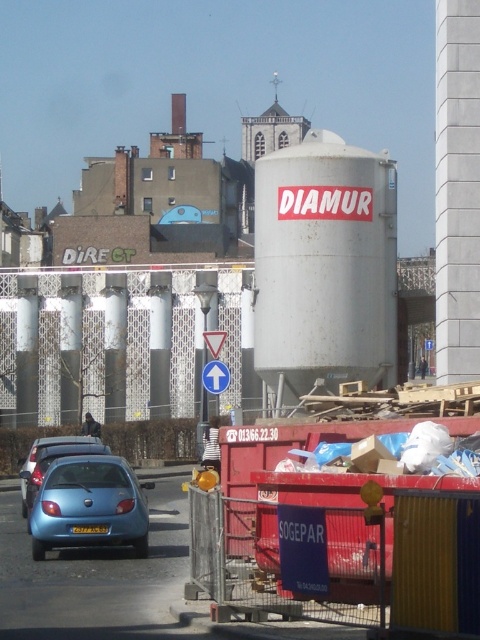
Can you confirm if rusty metal water tower at center is positioned to the right of matte blue car at lower left?

Correct, you'll find rusty metal water tower at center to the right of matte blue car at lower left.

Which is in front, point (272, 385) or point (84, 483)?

Point (84, 483)

This screenshot has height=640, width=480. Describe the element at coordinates (324, 266) in the screenshot. I see `rusty metal water tower at center` at that location.

At what (x,y) coordinates should I click in order to perform the action: click on rusty metal water tower at center. Please return your answer as a coordinate pair (x, y). The width and height of the screenshot is (480, 640). Looking at the image, I should click on (324, 266).

Which of these two, rusty metal water tower at center or white plastic traffic sign at center, stands taller?

With more height is rusty metal water tower at center.

Does point (369, 296) come farther from viewer compared to point (220, 381)?

Yes, it is.

Between point (304, 248) and point (226, 371), which one is positioned in front?

Positioned in front is point (226, 371).

In order to click on rusty metal water tower at center in this screenshot , I will do `click(324, 266)`.

Can you confirm if matte blue car at lower left is shorter than matte blue hatchback at lower left?

No, matte blue car at lower left is not shorter than matte blue hatchback at lower left.

Does matte blue car at lower left appear under matte blue hatchback at lower left?

Indeed, matte blue car at lower left is positioned under matte blue hatchback at lower left.

You are a GUI agent. You are given a task and a screenshot of the screen. Output one action in this format:
    pyautogui.click(x=<x>, y=<y>)
    Task: Click on the matte blue car at lower left
    The height and width of the screenshot is (640, 480).
    Given the screenshot: What is the action you would take?
    pyautogui.click(x=90, y=506)